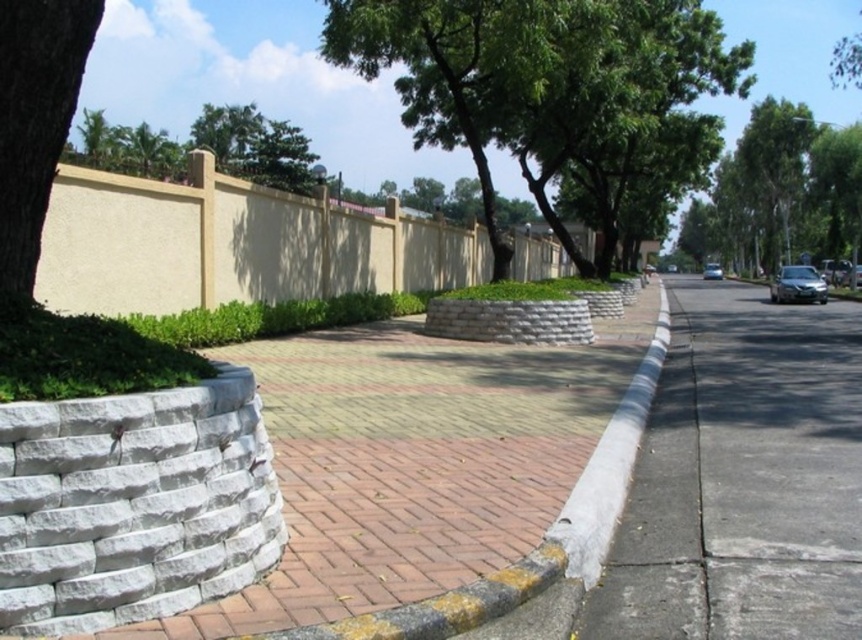
Question: Is green leafy tree at center bigger than green leafy tree at upper center?

Choices:
 (A) yes
 (B) no

Answer: (B)

Question: Can you confirm if green leafy tree at center is positioned to the right of green leafy tree at upper center?

Choices:
 (A) no
 (B) yes

Answer: (B)

Question: Is gray concrete sidewalk at center to the right of green leafy tree at upper center from the viewer's perspective?

Choices:
 (A) yes
 (B) no

Answer: (A)

Question: Which of the following is the closest to the observer?

Choices:
 (A) gray concrete sidewalk at center
 (B) sleek silver sedan at right

Answer: (A)

Question: Which point is farther from the camera taking this photo?

Choices:
 (A) (707, 273)
 (B) (797, 278)
 (C) (145, 144)
 (D) (479, 38)

Answer: (A)

Question: Which of these objects is positioned farthest from the brown rough bark tree at left?

Choices:
 (A) sleek silver sedan at right
 (B) green leafy tree at center
 (C) green leafy tree at upper center

Answer: (A)